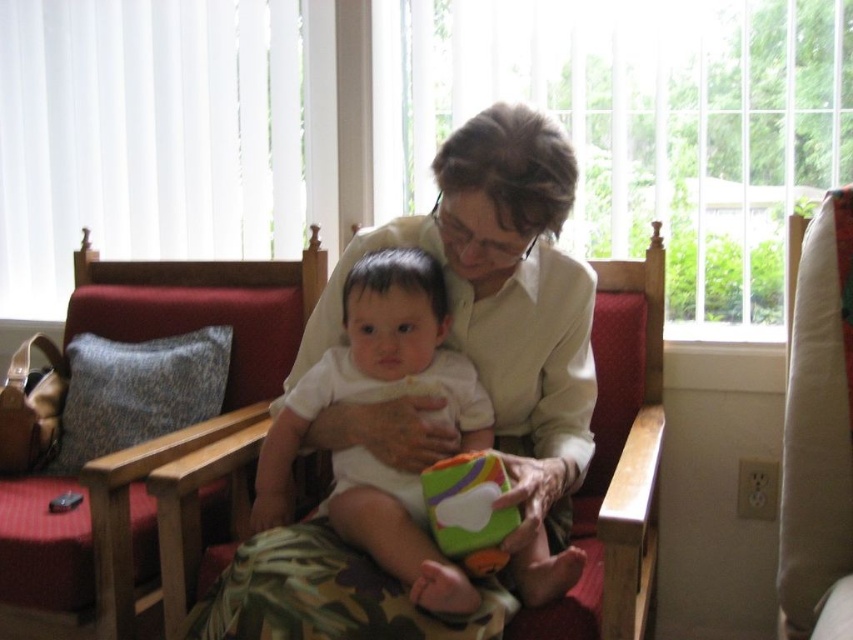
You are a parent holding a baby and want to move from the bench to one of the rocking chairs to rock the baby. The baby weighs 8 kilograms. The red fabric rocking chair at left has a weight limit of 100 kilograms, and the beige fabric rocking chair at right has a weight limit of 80 kilograms. Which rocking chair should you choose to safely rock the baby?

You should choose the red fabric rocking chair at left because its weight limit of 100 kilograms can safely accommodate both you and the baby, whereas the beige fabric rocking chair at right has a weight limit of 80 kilograms, which may be insufficient depending on your combined weight.

You are a photographer setting up a shot of the scene. The camera is positioned to focus on the white matte onesie at center. To ensure the onesie is in the center of the frame, do you need to adjust the camera position? Explain using the coordinates provided in the description.

The white matte onesie at center is already located at the coordinates specified, which align with the center of the frame. Therefore, no adjustment is needed to keep it centered.

You are a parent holding a baby and want to move from the bench to the beige fabric rocking chair at right. The baby is 2 feet tall. Can you safely carry the baby while moving to the chair without bending down?

The distance between the beige fabric rocking chair at right and the camera is 3.97 feet. Since the baby is 2 feet tall, you can safely carry the baby without bending down as the distance is sufficient.